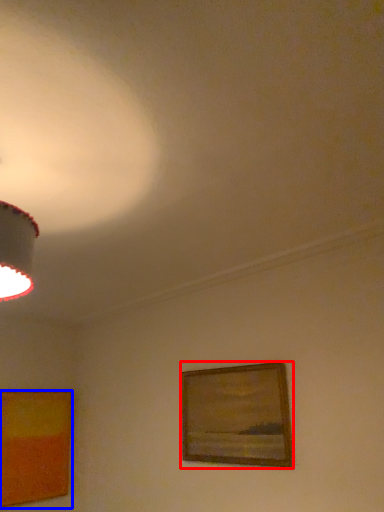
Question: Which object appears farthest to the camera in this image, picture frame (highlighted by a red box) or picture frame (highlighted by a blue box)?

Choices:
 (A) picture frame
 (B) picture frame

Answer: (B)